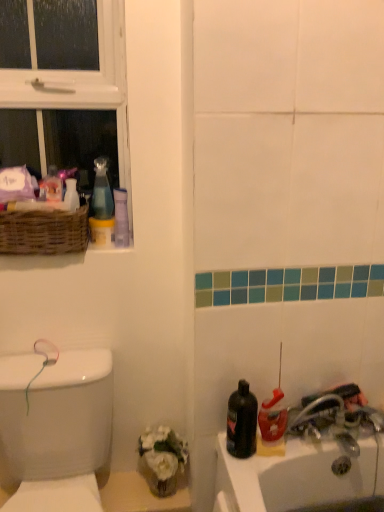
Question: Can you confirm if black matte bottle at lower right is smaller than white glossy vase at upper left?

Choices:
 (A) yes
 (B) no

Answer: (B)

Question: Is the position of black matte bottle at lower right more distant than that of white glossy vase at upper left?

Choices:
 (A) no
 (B) yes

Answer: (A)

Question: Is black matte bottle at lower right outside white glossy vase at upper left?

Choices:
 (A) yes
 (B) no

Answer: (A)

Question: Is black matte bottle at lower right at the right side of white glossy vase at upper left?

Choices:
 (A) no
 (B) yes

Answer: (B)

Question: Is white glossy vase at upper left a part of black matte bottle at lower right?

Choices:
 (A) no
 (B) yes

Answer: (A)

Question: Is black matte bottle at lower right far from white glossy vase at upper left?

Choices:
 (A) no
 (B) yes

Answer: (A)

Question: Does black matte bottle at lower right contain white glossy porcelain at left?

Choices:
 (A) yes
 (B) no

Answer: (B)

Question: Does black matte bottle at lower right come in front of white glossy porcelain at left?

Choices:
 (A) no
 (B) yes

Answer: (A)

Question: Can you confirm if black matte bottle at lower right is positioned to the right of white glossy porcelain at left?

Choices:
 (A) no
 (B) yes

Answer: (B)

Question: Could you tell me if black matte bottle at lower right is turned towards white glossy porcelain at left?

Choices:
 (A) no
 (B) yes

Answer: (A)

Question: From the image's perspective, is black matte bottle at lower right over white glossy porcelain at left?

Choices:
 (A) yes
 (B) no

Answer: (A)

Question: Is black matte bottle at lower right in contact with white glossy porcelain at left?

Choices:
 (A) no
 (B) yes

Answer: (A)

Question: Is white plastic window at upper left closer to camera compared to translucent plastic spray bottle at lower right, marked as the 1th cleaning product in a bottom-to-top arrangement?

Choices:
 (A) yes
 (B) no

Answer: (B)